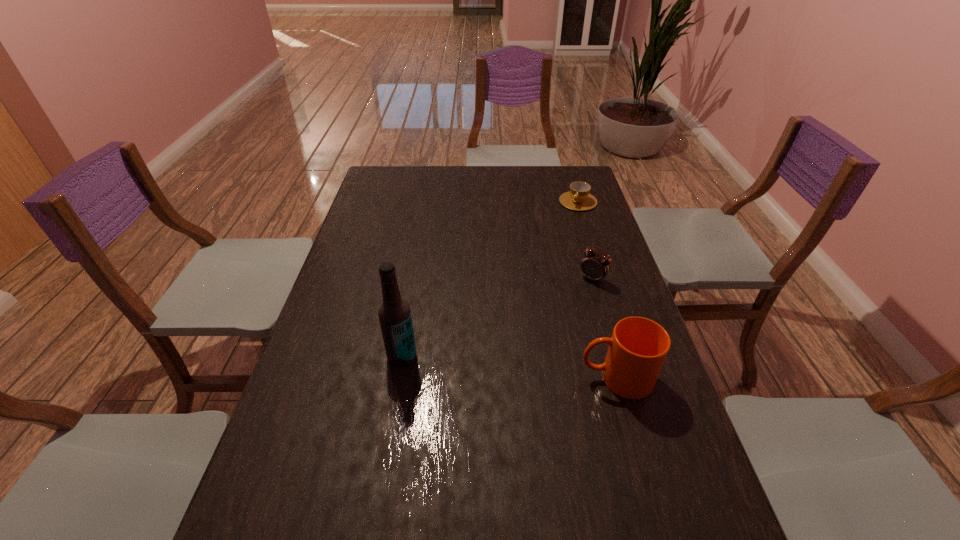
The height and width of the screenshot is (540, 960). Find the location of `vacant spot on the desktop that is between the leftmost object and the mug and is positioned on the face of the second farthest object`. vacant spot on the desktop that is between the leftmost object and the mug and is positioned on the face of the second farthest object is located at coordinates (512, 367).

The height and width of the screenshot is (540, 960). Identify the location of vacant spot on the desktop that is between the leftmost object and the third shortest object and is positioned with the handle on the side of the cup. (483, 364).